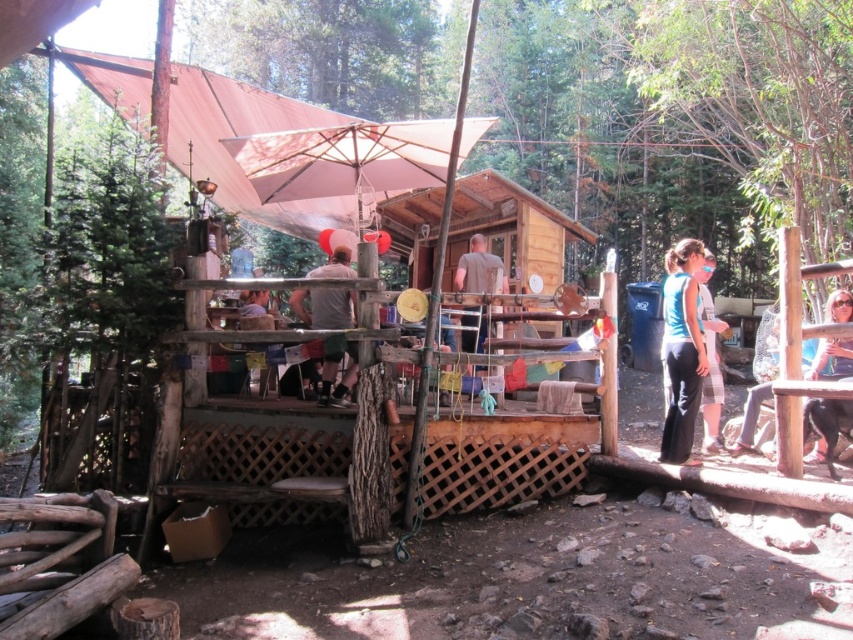
You are planning to place a new decorative item on the deck. The light brown wooden chair at center and the blue fabric shirt at center are currently there. Which object can you replace to make more space for the new item?

The light brown wooden chair at center occupies less space than the blue fabric shirt at center, so replacing the blue fabric shirt at center would free up more space for the new decorative item.

You are standing on the deck and want to hand a drink to both the blue fabric pants at lower right and the black leather jacket at lower right. Which person should you approach first to ensure you can reach them without moving?

You should approach the blue fabric pants at lower right first because it is closer to you than the black leather jacket at lower right, so you can reach them without moving first.

You are standing at the edge of the wooden deck and want to walk to the point that is closer to you. Which point should you walk towards, point (x=685, y=417) or point (x=323, y=308)?

You should walk towards point (x=685, y=417) because it is closer to the viewer than point (x=323, y=308).